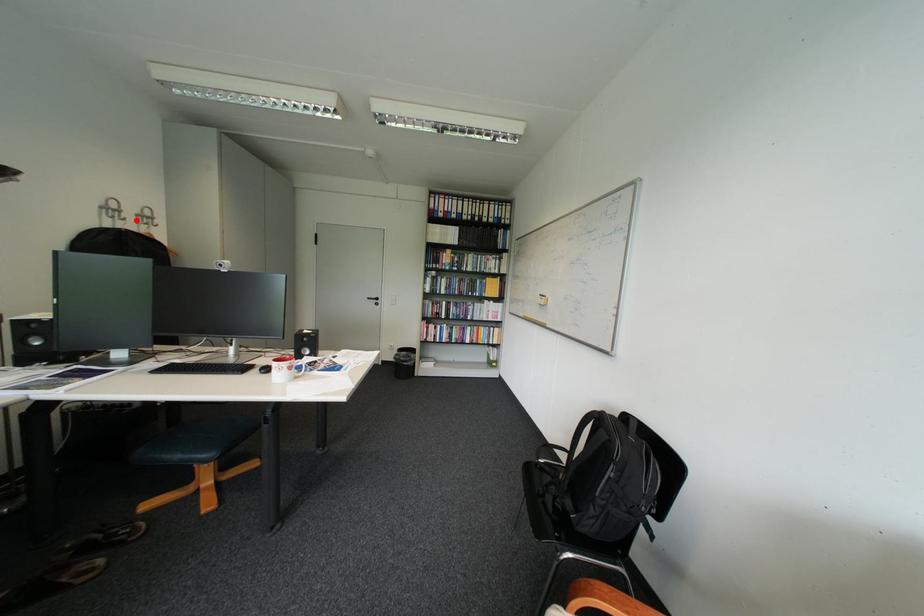
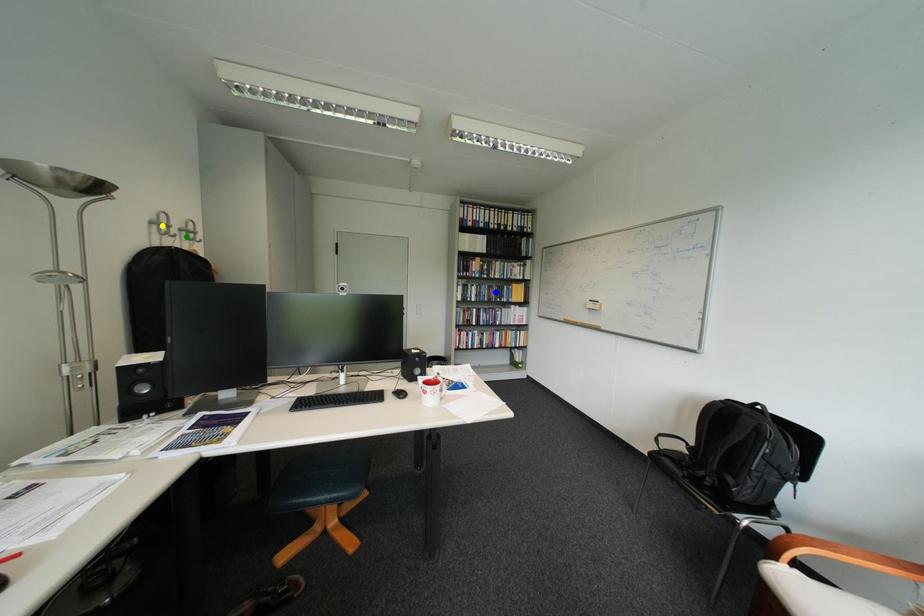
Question: I am providing you with two images of the same scene from different viewpoints. A red point is marked on the first image. You are given multiple points on the second image. Can you choose the point in image 2 that corresponds to the point in image 1?

Choices:
 (A) green point
 (B) blue point
 (C) yellow point

Answer: (A)